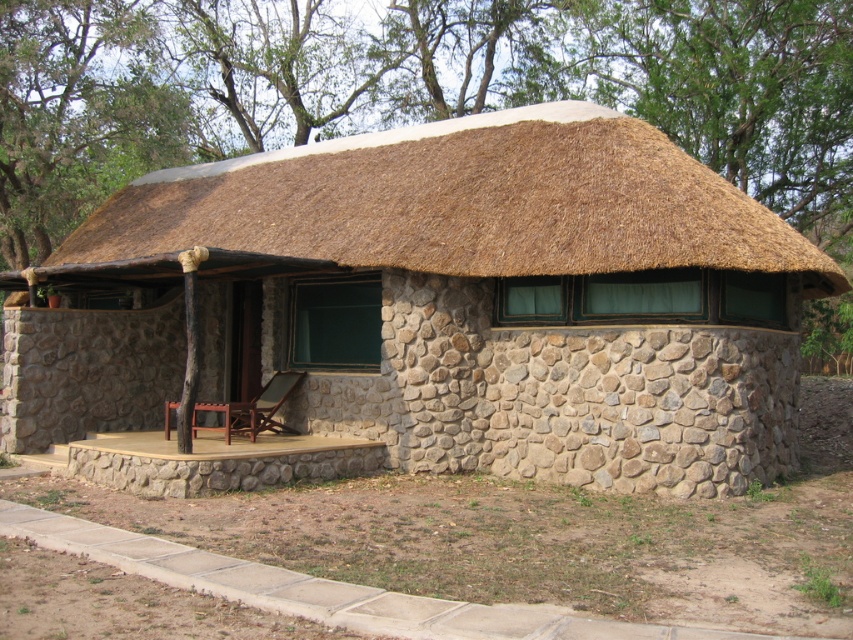
Question: Which point is farther to the camera?

Choices:
 (A) (36, 401)
 (B) (547, 148)
 (C) (230, 408)

Answer: (A)

Question: Which object is closer to the camera taking this photo?

Choices:
 (A) thatched straw roof at upper center
 (B) stone textured hut at center

Answer: (B)

Question: Is stone textured hut at center below thatched straw roof at upper center?

Choices:
 (A) no
 (B) yes

Answer: (B)

Question: Where is stone textured hut at center located in relation to thatched straw roof at upper center in the image?

Choices:
 (A) above
 (B) below

Answer: (B)

Question: Which object is closer to the camera taking this photo?

Choices:
 (A) stone textured hut at center
 (B) wooden deck chair at lower center

Answer: (A)

Question: Does thatched straw roof at upper center appear over wooden deck chair at lower center?

Choices:
 (A) yes
 (B) no

Answer: (A)